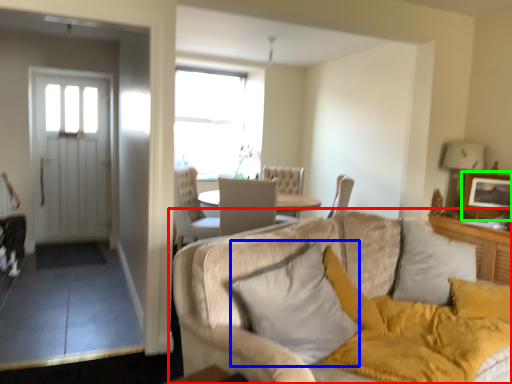
Question: Considering the real-world distances, which object is closest to studio couch (highlighted by a red box)? pillow (highlighted by a blue box) or picture frame (highlighted by a green box).

Choices:
 (A) pillow
 (B) picture frame

Answer: (A)